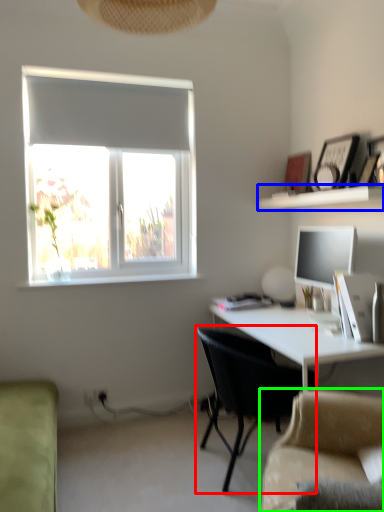
Question: Which object is positioned farthest from chair (highlighted by a red box)? Select from shelf (highlighted by a blue box) and studio couch (highlighted by a green box).

Choices:
 (A) shelf
 (B) studio couch

Answer: (A)